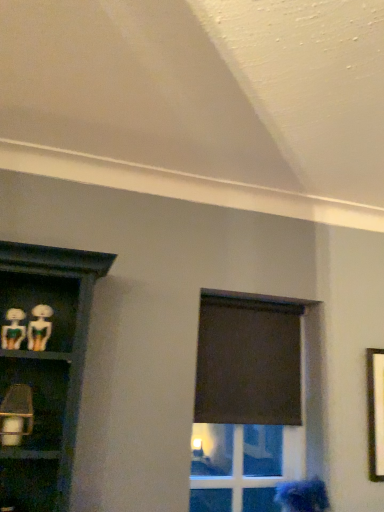
Question: Does point (29, 349) appear closer or farther from the camera than point (196, 503)?

Choices:
 (A) closer
 (B) farther

Answer: (A)

Question: Would you say matte green plastic skeleton at left, which ranks as the 2th woman in top-to-bottom order, is to the left or to the right of transparent glass door at center in the picture?

Choices:
 (A) left
 (B) right

Answer: (A)

Question: Which of these objects is positioned closest to the blue fabric at lower right, arranged as the third woman when viewed from the front?

Choices:
 (A) matte green plastic skeleton at left, the first woman from the left
 (B) black matte curtain at upper center
 (C) matte green plastic skeleton at left, which ranks as the 2th woman in bottom-to-top order
 (D) transparent glass door at center

Answer: (B)

Question: Estimate the real-world distances between objects in this image. Which object is closer to the matte green plastic skeleton at left, which ranks as the 3th woman in right-to-left order?

Choices:
 (A) transparent glass door at center
 (B) blue fabric at lower right, the third woman when ordered from left to right
 (C) black matte curtain at upper center
 (D) matte green plastic skeleton at left, the 2th woman viewed from the back

Answer: (D)